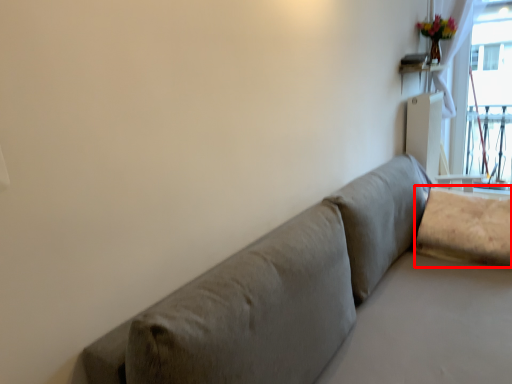
Question: From the image's perspective, where is pillow (annotated by the red box) located in relation to table in the image?

Choices:
 (A) above
 (B) below

Answer: (B)